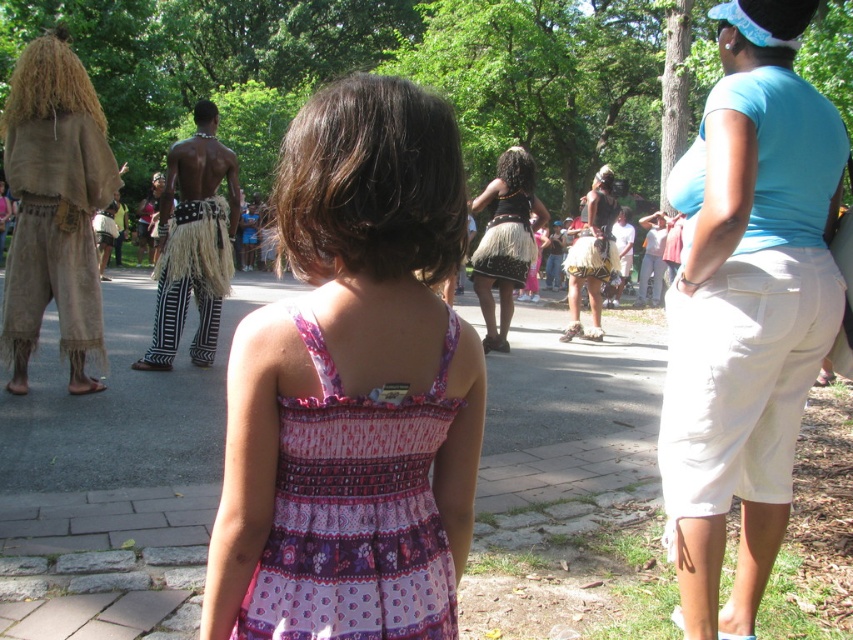
Can you confirm if brown woven fabric at left is smaller than black grass skirt at center?

Incorrect, brown woven fabric at left is not smaller in size than black grass skirt at center.

Can you confirm if brown woven fabric at left is positioned below black grass skirt at center?

Correct, brown woven fabric at left is located below black grass skirt at center.

Image resolution: width=853 pixels, height=640 pixels. I want to click on brown woven fabric at left, so click(54, 209).

Locate an element on the screen. The height and width of the screenshot is (640, 853). brown woven fabric at left is located at coordinates (54, 209).

The height and width of the screenshot is (640, 853). What do you see at coordinates (54, 209) in the screenshot?
I see `brown woven fabric at left` at bounding box center [54, 209].

In the scene shown: Who is lower down, brown woven fabric at left or black textured skirt at center?

black textured skirt at center is below.

Does point (33, 250) lie behind point (616, 266)?

That is False.

The width and height of the screenshot is (853, 640). What are the coordinates of `brown woven fabric at left` in the screenshot? It's located at (54, 209).

Between pink printed dress at center and black grass skirt at center, which one is positioned higher?

black grass skirt at center is above.

Which is in front, point (294, 257) or point (525, 221)?

Point (294, 257) is more forward.

This screenshot has height=640, width=853. In order to click on pink printed dress at center in this screenshot , I will do `click(352, 387)`.

Where is `pink printed dress at center`? The height and width of the screenshot is (640, 853). pink printed dress at center is located at coordinates (352, 387).